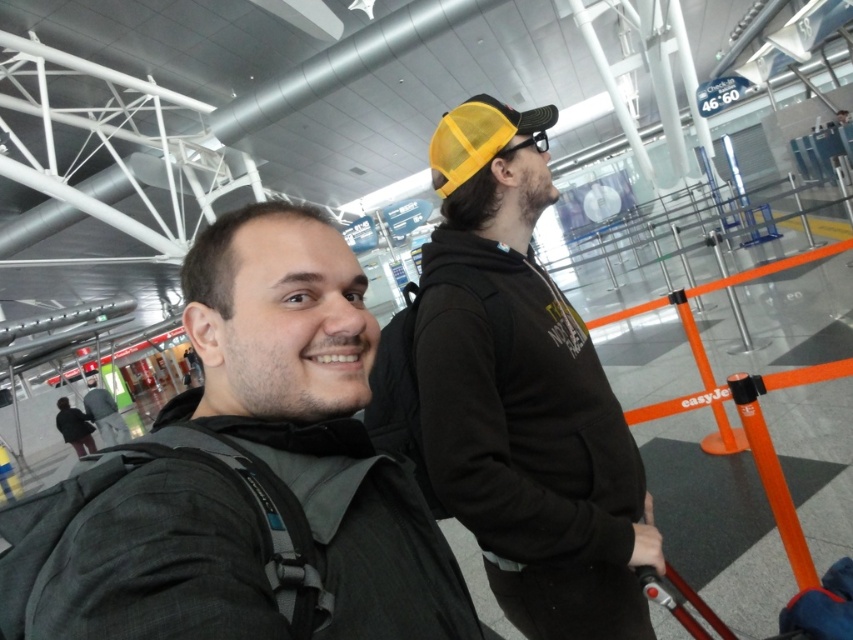
Question: Based on their relative distances, which object is farther from the matte black hoodie at center?

Choices:
 (A) dark gray backpack at center
 (B) yellow mesh cap at upper center

Answer: (A)

Question: Which of the following is the closest to the observer?

Choices:
 (A) (564, 468)
 (B) (227, 321)

Answer: (B)

Question: Does matte black hoodie at center have a greater width compared to yellow mesh cap at upper center?

Choices:
 (A) yes
 (B) no

Answer: (A)

Question: Which of these objects is positioned closest to the yellow mesh cap at upper center?

Choices:
 (A) matte black hoodie at center
 (B) dark gray backpack at center

Answer: (A)

Question: Does matte black hoodie at center appear over yellow mesh cap at upper center?

Choices:
 (A) no
 (B) yes

Answer: (A)

Question: Is dark gray backpack at center positioned behind yellow mesh cap at upper center?

Choices:
 (A) yes
 (B) no

Answer: (B)